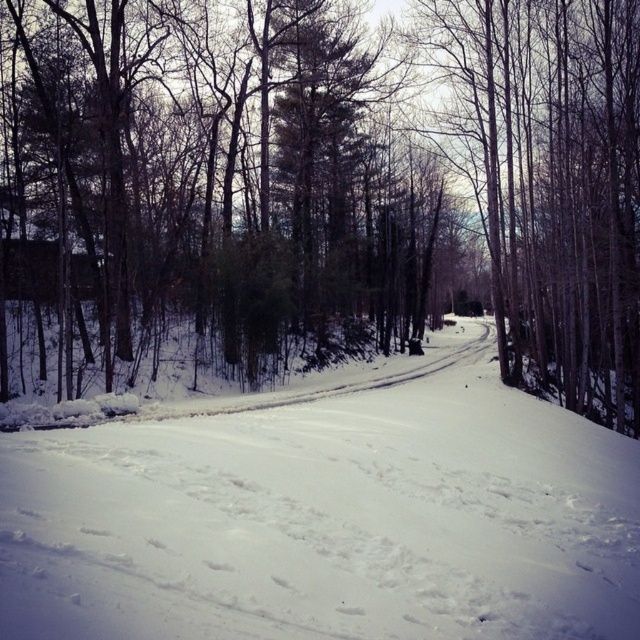
Question: Is green textured pine tree at center positioned at the back of white powdery snow at center?

Choices:
 (A) yes
 (B) no

Answer: (A)

Question: Among these objects, which one is farthest from the camera?

Choices:
 (A) white powdery snow at center
 (B) green textured pine tree at center

Answer: (B)

Question: Is green textured pine tree at center to the left of white powdery snow at center from the viewer's perspective?

Choices:
 (A) no
 (B) yes

Answer: (A)

Question: Is green textured pine tree at center closer to camera compared to white powdery snow at center?

Choices:
 (A) yes
 (B) no

Answer: (B)